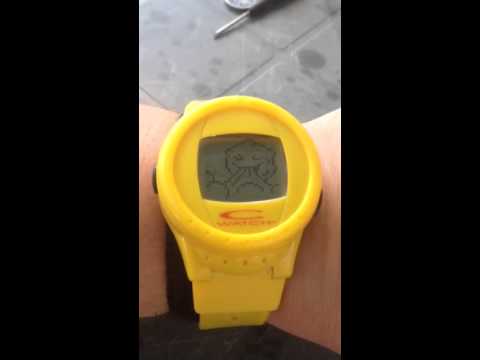
Identify the location of led. (259, 174).